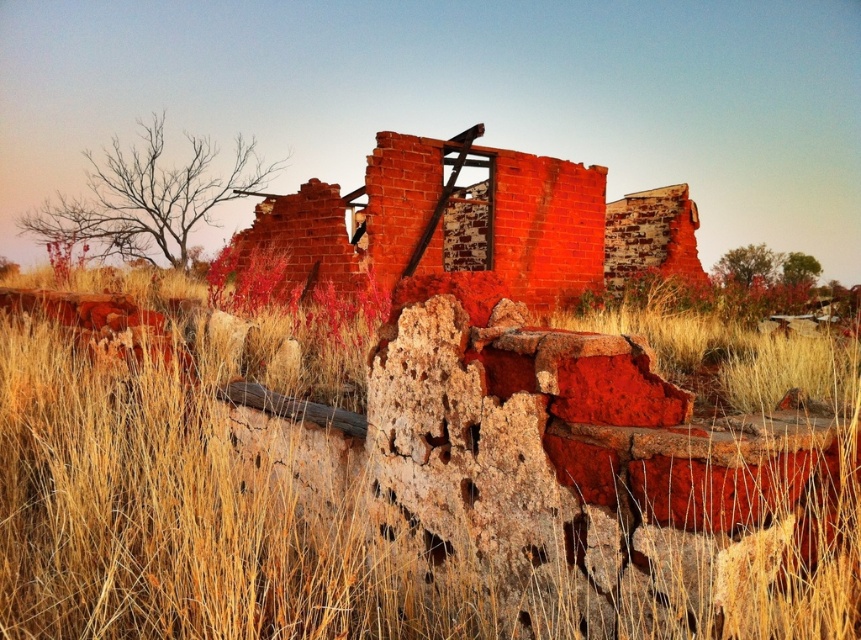
You are standing at the point with coordinates point (x=393, y=188) and want to walk towards the point with coordinates point (x=104, y=465). Which direction should you face to move towards it?

You should face towards the direction of point (x=104, y=465), which is in front of your current position at point (x=393, y=188).